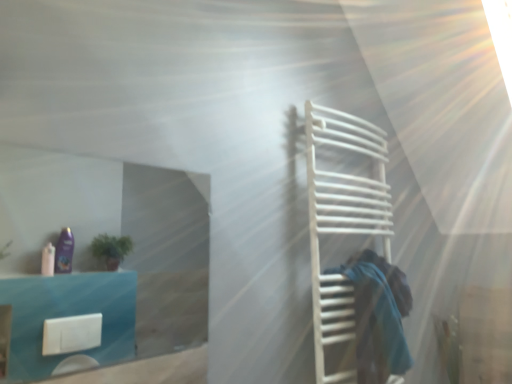
Question: Considering the relative sizes of transparent glass door at upper left and blue fabric at right in the image provided, is transparent glass door at upper left taller than blue fabric at right?

Choices:
 (A) no
 (B) yes

Answer: (B)

Question: Does transparent glass door at upper left come behind blue fabric at right?

Choices:
 (A) yes
 (B) no

Answer: (B)

Question: Is transparent glass door at upper left positioned with its back to blue fabric at right?

Choices:
 (A) no
 (B) yes

Answer: (A)

Question: Is transparent glass door at upper left bigger than blue fabric at right?

Choices:
 (A) no
 (B) yes

Answer: (A)

Question: Is transparent glass door at upper left outside of blue fabric at right?

Choices:
 (A) yes
 (B) no

Answer: (A)

Question: Would you consider transparent glass door at upper left to be distant from blue fabric at right?

Choices:
 (A) no
 (B) yes

Answer: (B)

Question: Does white matte towel rack at right come behind transparent glass door at upper left?

Choices:
 (A) yes
 (B) no

Answer: (A)

Question: Is white matte towel rack at right positioned before transparent glass door at upper left?

Choices:
 (A) no
 (B) yes

Answer: (A)

Question: Does white matte towel rack at right have a lesser width compared to transparent glass door at upper left?

Choices:
 (A) yes
 (B) no

Answer: (B)

Question: Can you confirm if white matte towel rack at right is smaller than transparent glass door at upper left?

Choices:
 (A) yes
 (B) no

Answer: (B)

Question: From the image's perspective, is white matte towel rack at right on transparent glass door at upper left?

Choices:
 (A) yes
 (B) no

Answer: (B)

Question: Considering the relative sizes of white matte towel rack at right and transparent glass door at upper left in the image provided, is white matte towel rack at right taller than transparent glass door at upper left?

Choices:
 (A) no
 (B) yes

Answer: (B)

Question: Considering the relative sizes of blue fabric at right and white matte towel rack at right in the image provided, is blue fabric at right thinner than white matte towel rack at right?

Choices:
 (A) no
 (B) yes

Answer: (B)